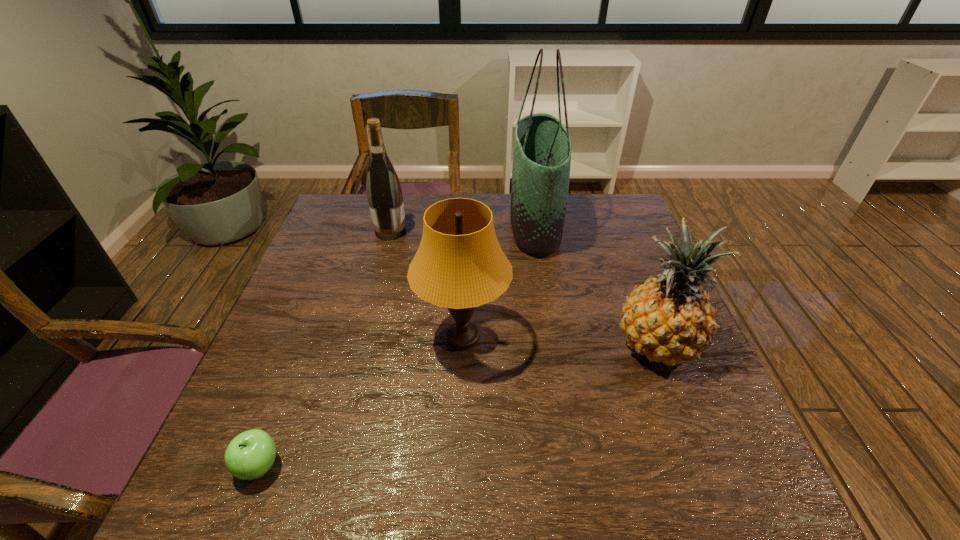
This screenshot has height=540, width=960. I want to click on the second object from right to left, so click(x=542, y=146).

Identify the location of tote bag. This screenshot has width=960, height=540. (542, 146).

You are a GUI agent. You are given a task and a screenshot of the screen. Output one action in this format:
    pyautogui.click(x=<x>, y=<y>)
    Task: Click on the fourth object from right to left
    
    Given the screenshot: What is the action you would take?
    pyautogui.click(x=384, y=193)

What are the coordinates of `lampshade` in the screenshot? It's located at (459, 264).

At what (x,y) coordinates should I click in order to perform the action: click on pineapple. Please return your answer as a coordinate pair (x, y). Image resolution: width=960 pixels, height=540 pixels. Looking at the image, I should click on (669, 319).

What are the coordinates of `the shortest object` in the screenshot? It's located at (249, 455).

This screenshot has height=540, width=960. What are the coordinates of `the leftmost object` in the screenshot? It's located at (249, 455).

What are the coordinates of `vacant space located 0.140m on the right of the tote bag` in the screenshot? It's located at (605, 224).

Image resolution: width=960 pixels, height=540 pixels. Find the location of `free location located on the label of the wine bottle`. free location located on the label of the wine bottle is located at coordinates (490, 232).

I want to click on vacant space located on the right of the third object from right to left, so click(556, 338).